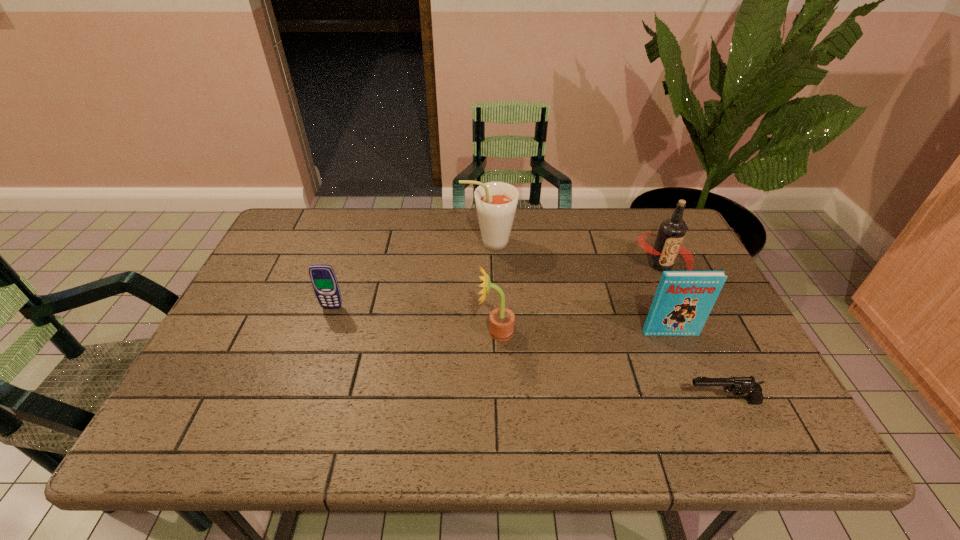
Identify the location of vacant space located 0.390m on the drink side of the left root beer. The image size is (960, 540). (334, 243).

Find the location of a particular element. free space located 0.120m on the label of the right root beer is located at coordinates (686, 320).

Where is `vacant region located 0.060m on the face of the sunflower`? vacant region located 0.060m on the face of the sunflower is located at coordinates (454, 332).

Where is `vacant position located 0.250m on the face of the sunflower`? The width and height of the screenshot is (960, 540). vacant position located 0.250m on the face of the sunflower is located at coordinates (377, 332).

This screenshot has height=540, width=960. I want to click on vacant space located on the face of the sunflower, so click(x=328, y=332).

Where is `free space located on the front cover of the book`? The height and width of the screenshot is (540, 960). free space located on the front cover of the book is located at coordinates [706, 417].

This screenshot has width=960, height=540. Identify the location of vacant space situated on the front-facing side of the cellular telephone. (323, 336).

The height and width of the screenshot is (540, 960). I want to click on free space located at the end of the barrel of the gun, so click(641, 402).

Locate an element on the screen. vacant region located 0.110m at the end of the barrel of the gun is located at coordinates (633, 402).

Where is `vacant region located at the end of the barrel of the gun`? The image size is (960, 540). vacant region located at the end of the barrel of the gun is located at coordinates (636, 402).